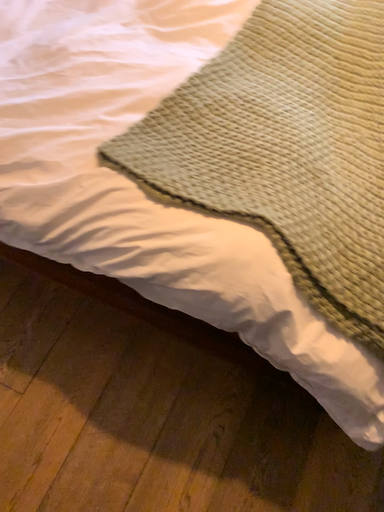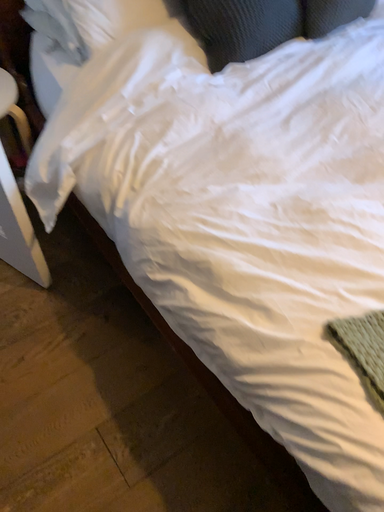
Question: Which way did the camera rotate in the video?

Choices:
 (A) rotated left
 (B) rotated right

Answer: (A)